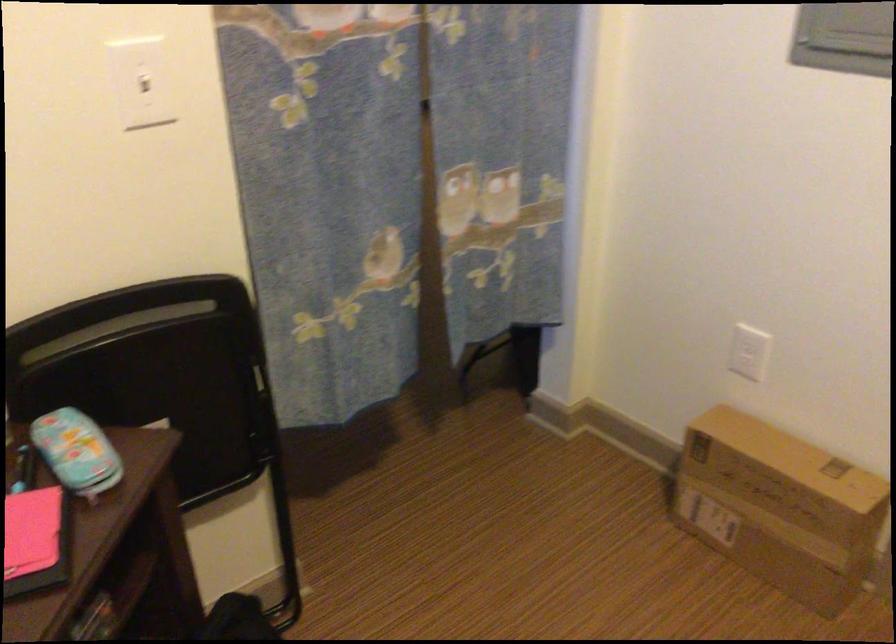
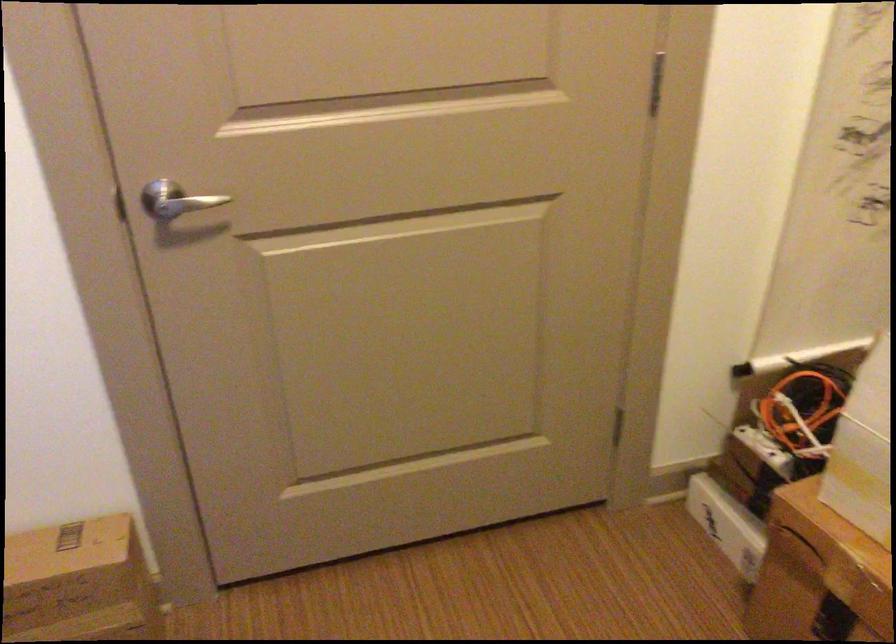
Find the pixel in the second image that matches point (813, 494) in the first image.

(79, 583)